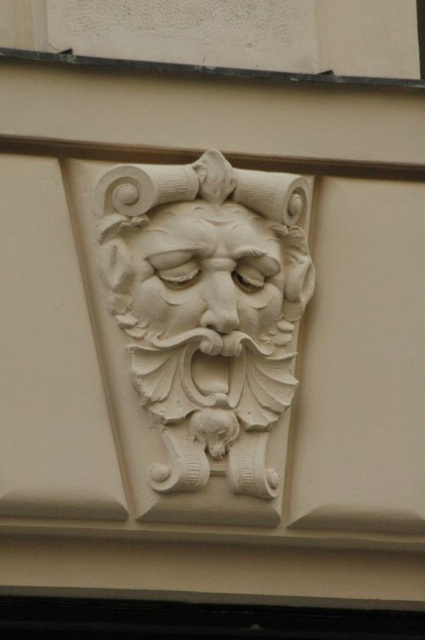
Can you confirm if white stone mask at center is positioned above white stone face at center?

Actually, white stone mask at center is below white stone face at center.

Can you confirm if white stone mask at center is thinner than white stone face at center?

No.

Image resolution: width=425 pixels, height=640 pixels. What do you see at coordinates (206, 308) in the screenshot? I see `white stone mask at center` at bounding box center [206, 308].

Find the location of `white stone mask at center`. white stone mask at center is located at coordinates (206, 308).